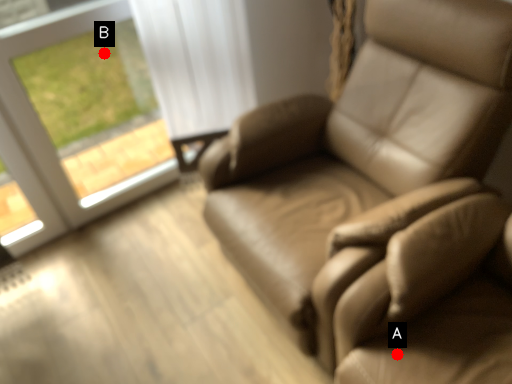
Question: Two points are circled on the image, labeled by A and B beside each circle. Which point appears farthest from the camera in this image?

Choices:
 (A) A is further
 (B) B is further

Answer: (B)